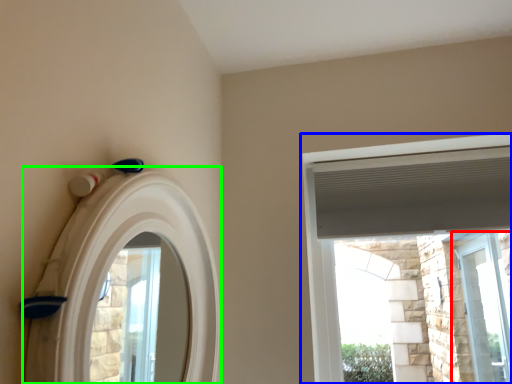
Question: Based on their relative distances, which object is nearer to window (highlighted by a red box)? Choose from window (highlighted by a blue box) and archway (highlighted by a green box).

Choices:
 (A) window
 (B) archway

Answer: (A)